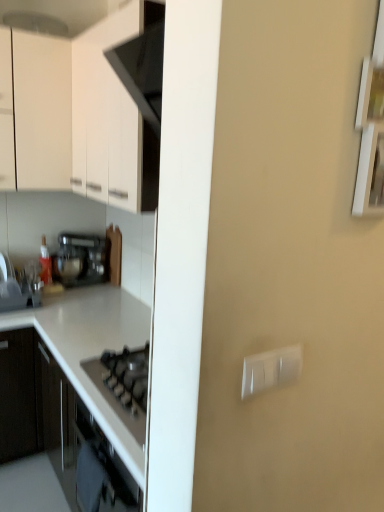
Describe the element at coordinates (77, 115) in the screenshot. I see `white matte cabinet at upper left` at that location.

What is the approximate height of white glossy countertop at lower left?

It is 34.54 inches.

What are the coordinates of `white glossy countertop at lower left` in the screenshot? It's located at (91, 348).

The width and height of the screenshot is (384, 512). Identify the location of satin black toaster at left. (81, 259).

Find the location of a particular element. The height and width of the screenshot is (512, 384). white plastic switch at right is located at coordinates (271, 369).

Is satin black toaster at left not inside white glossy countertop at lower left?

Indeed, satin black toaster at left is completely outside white glossy countertop at lower left.

Based on the photo, from the image's perspective, between satin black toaster at left and white glossy countertop at lower left, who is located below?

white glossy countertop at lower left appears lower in the image.

Between satin black toaster at left and white glossy countertop at lower left, which one has less height?

Standing shorter between the two is satin black toaster at left.

Considering the sizes of white glossy countertop at lower left and white matte cabinet at upper left in the image, is white glossy countertop at lower left taller or shorter than white matte cabinet at upper left?

Clearly, white glossy countertop at lower left is taller compared to white matte cabinet at upper left.

Identify the location of countertop located behind the white matte cabinet at upper left. (91, 348).

From the image's perspective, is white glossy countertop at lower left positioned above or below white matte cabinet at upper left?

white glossy countertop at lower left is below white matte cabinet at upper left.

Does white glossy countertop at lower left turn towards white matte cabinet at upper left?

No, white glossy countertop at lower left does not turn towards white matte cabinet at upper left.

Considering the relative positions of white glossy countertop at lower left and white plastic switch at right in the image provided, is white glossy countertop at lower left to the left of white plastic switch at right from the viewer's perspective?

Yes, white glossy countertop at lower left is to the left of white plastic switch at right.

Does white glossy countertop at lower left have a larger size compared to white plastic switch at right?

Yes, white glossy countertop at lower left is bigger than white plastic switch at right.

Is white glossy countertop at lower left oriented away from white plastic switch at right?

No, white glossy countertop at lower left's orientation is not away from white plastic switch at right.

Is satin black toaster at left turned away from white matte cabinet at upper left?

That's not correct — satin black toaster at left is not looking away from white matte cabinet at upper left.

Identify the location of kitchen appliance below the white matte cabinet at upper left (from the image's perspective). point(81,259).

From a real-world perspective, which is physically above, satin black toaster at left or white matte cabinet at upper left?

From a 3D spatial view, white matte cabinet at upper left is above.

Does satin black toaster at left come in front of white plastic switch at right?

No, it is not.

From a real-world perspective, between satin black toaster at left and white plastic switch at right, who is vertically higher?

white plastic switch at right, from a real-world perspective.

From the image's perspective, does satin black toaster at left appear higher than white plastic switch at right?

Yes, from the image's perspective, satin black toaster at left is over white plastic switch at right.

From the image's perspective, relative to satin black toaster at left, is white plastic switch at right above or below?

From the image's perspective, white plastic switch at right appears below satin black toaster at left.

From the picture: Considering the sizes of objects white plastic switch at right and satin black toaster at left in the image provided, who is wider, white plastic switch at right or satin black toaster at left?

satin black toaster at left is wider.

Which object is closer to the camera, white plastic switch at right or satin black toaster at left?

white plastic switch at right.

Which is behind, point (265, 376) or point (1, 135)?

The point (1, 135) is behind.

Looking at their sizes, would you say white plastic switch at right is wider or thinner than white matte cabinet at upper left?

white plastic switch at right is thinner than white matte cabinet at upper left.

Which of these two, white plastic switch at right or white matte cabinet at upper left, is smaller?

With smaller size is white plastic switch at right.

Based on the photo, between white plastic switch at right and white matte cabinet at upper left, which one is positioned in front?

white plastic switch at right is in front.

Where is `countertop located below the satin black toaster at left (from the image's perspective)`? The image size is (384, 512). countertop located below the satin black toaster at left (from the image's perspective) is located at coordinates (91, 348).

Where is `cabinetry located on the right of white glossy countertop at lower left`? The image size is (384, 512). cabinetry located on the right of white glossy countertop at lower left is located at coordinates (77, 115).

Which object lies further to the anchor point satin black toaster at left, white matte cabinet at upper left or white glossy countertop at lower left?

Among the two, white matte cabinet at upper left is located further to satin black toaster at left.

Considering their positions, is satin black toaster at left positioned further to white plastic switch at right than white glossy countertop at lower left?

→ Among the two, satin black toaster at left is located further to white plastic switch at right.

When comparing their distances from white matte cabinet at upper left, does satin black toaster at left or white glossy countertop at lower left seem further?

The object further to white matte cabinet at upper left is white glossy countertop at lower left.

Looking at the image, which one is located further to white glossy countertop at lower left, satin black toaster at left or white plastic switch at right?

The object further to white glossy countertop at lower left is white plastic switch at right.

Considering their positions, is white glossy countertop at lower left positioned closer to satin black toaster at left than white matte cabinet at upper left?

white glossy countertop at lower left.

Based on their spatial positions, is satin black toaster at left or white plastic switch at right closer to white matte cabinet at upper left?

satin black toaster at left.

Looking at the image, which one is located closer to white plastic switch at right, satin black toaster at left or white matte cabinet at upper left?

white matte cabinet at upper left is positioned closer to the anchor white plastic switch at right.

From the image, which object appears to be nearer to white matte cabinet at upper left, white glossy countertop at lower left or white plastic switch at right?

Among the two, white glossy countertop at lower left is located nearer to white matte cabinet at upper left.

Where is `cabinetry positioned between white plastic switch at right and satin black toaster at left from near to far`? This screenshot has width=384, height=512. cabinetry positioned between white plastic switch at right and satin black toaster at left from near to far is located at coordinates (77, 115).

At what (x,y) coordinates should I click in order to perform the action: click on electric outlet that lies between white matte cabinet at upper left and white glossy countertop at lower left from top to bottom. Please return your answer as a coordinate pair (x, y). Looking at the image, I should click on (271, 369).

Locate an element on the screen. countertop located between white plastic switch at right and satin black toaster at left in the depth direction is located at coordinates (91, 348).

This screenshot has height=512, width=384. What are the coordinates of `kitchen appliance that lies between white matte cabinet at upper left and white glossy countertop at lower left from top to bottom` in the screenshot? It's located at click(x=81, y=259).